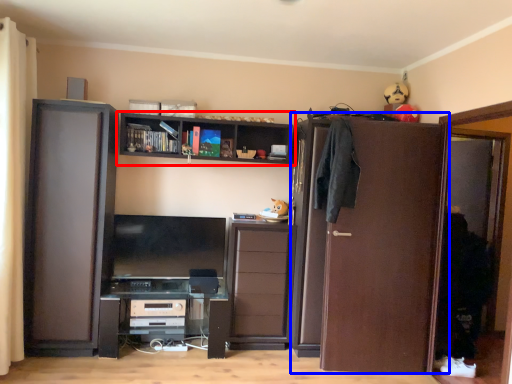
Question: Among these objects, which one is nearest to the camera, shelf (highlighted by a red box) or door (highlighted by a blue box)?

Choices:
 (A) shelf
 (B) door

Answer: (B)